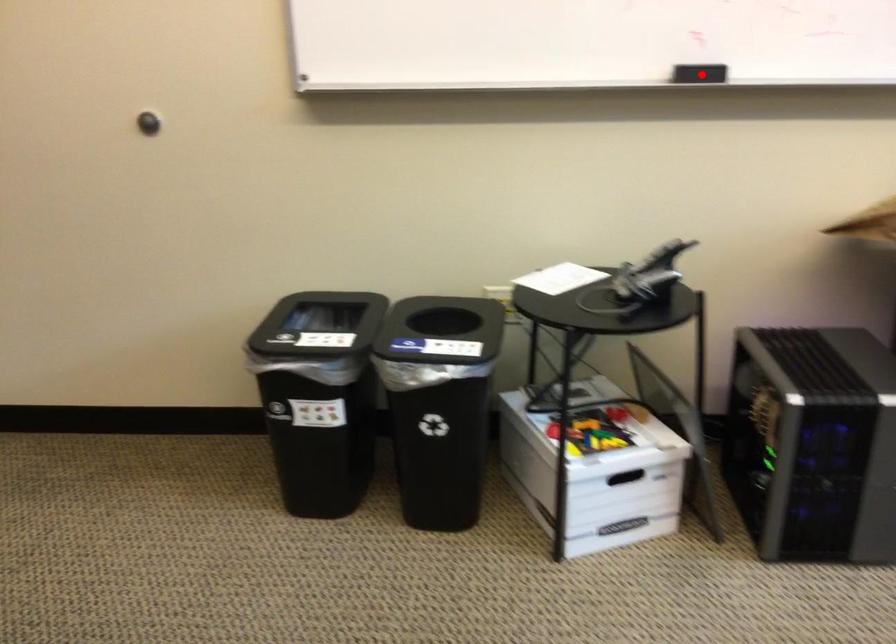
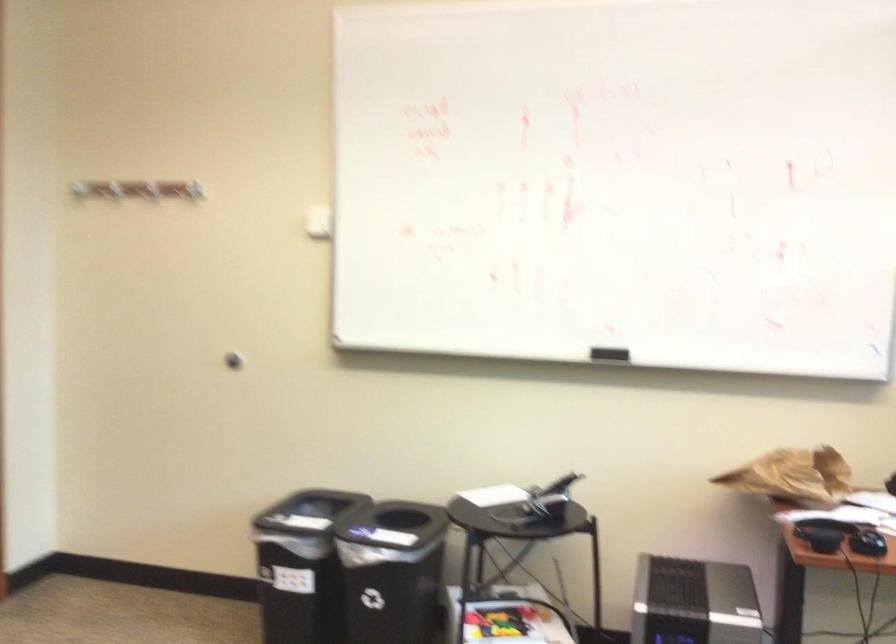
Question: I am providing you with two images of the same scene from different viewpoints. Image1 has a red point marked. In image2, the corresponding 3D location appears at what relative position? Reply with the corresponding letter.

Choices:
 (A) Closer
 (B) Farther

Answer: (B)